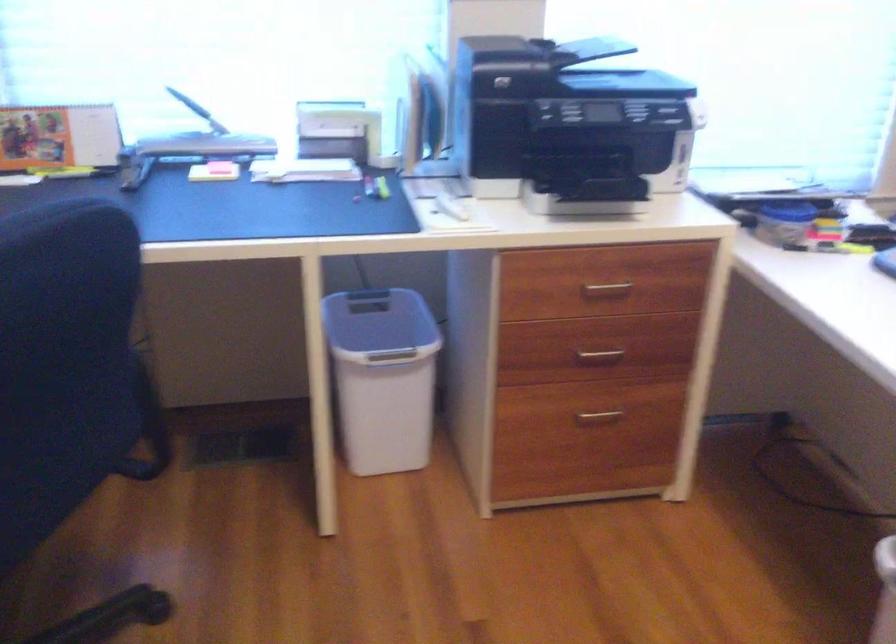
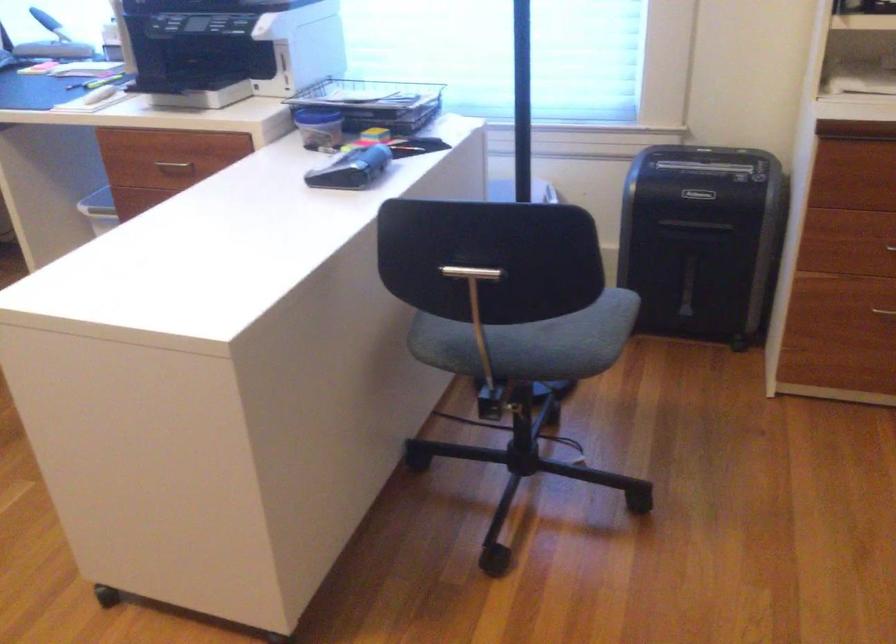
In the second image, find the point that corresponds to point 601,290 in the first image.

(174, 165)